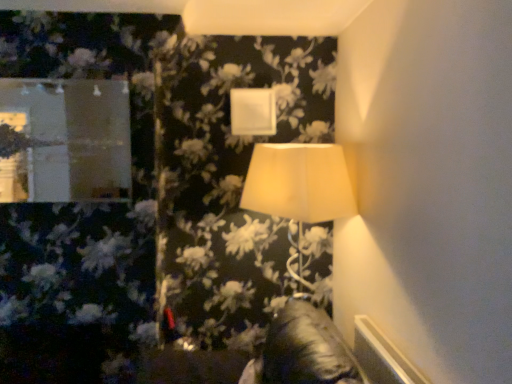
Question: Looking at their shapes, would you say matte white lampshade at center is wider or thinner than matte glass mirror at upper left?

Choices:
 (A) thin
 (B) wide

Answer: (B)

Question: Considering the relative positions of matte white lampshade at center and matte glass mirror at upper left in the image provided, is matte white lampshade at center to the left or to the right of matte glass mirror at upper left?

Choices:
 (A) left
 (B) right

Answer: (B)

Question: Considering the positions of point (293, 182) and point (91, 170), is point (293, 182) closer or farther from the camera than point (91, 170)?

Choices:
 (A) farther
 (B) closer

Answer: (B)

Question: Is matte glass mirror at upper left taller or shorter than matte white lampshade at center?

Choices:
 (A) tall
 (B) short

Answer: (B)

Question: From the image's perspective, is matte glass mirror at upper left positioned above or below matte white lampshade at center?

Choices:
 (A) below
 (B) above

Answer: (B)

Question: Does point (56, 180) appear closer or farther from the camera than point (246, 203)?

Choices:
 (A) farther
 (B) closer

Answer: (B)

Question: In the image, is matte glass mirror at upper left positioned in front of or behind matte white lampshade at center?

Choices:
 (A) front
 (B) behind

Answer: (B)